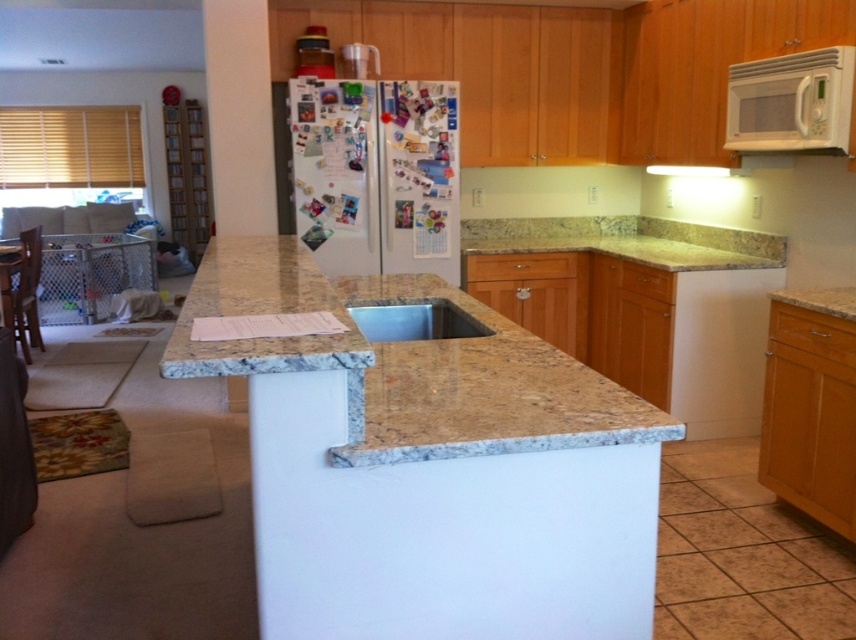
You are a chef holding a 1.2 meter long wooden cutting board. You want to place it on the beige granite countertop at center. Can you fit the cutting board on the countertop without it hanging over the edge?

The beige granite countertop at center is 1.19 meters from viewer. Since the cutting board is 1.2 meters long, it will hang over the edge by 1 centimeter.

You are a kitchen designer planning to install a new appliance. You have a white matte microwave at upper right and a metallic stainless steel sink at center in the current setup. Which appliance takes up more space in the kitchen?

The white matte microwave at upper right has a larger size compared to the metallic stainless steel sink at center, so it takes up more space in the kitchen.